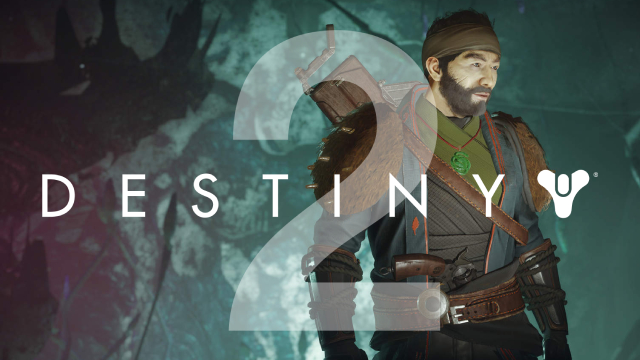
The height and width of the screenshot is (360, 640). What are the coordinates of `pendant` in the screenshot? It's located at (461, 162).